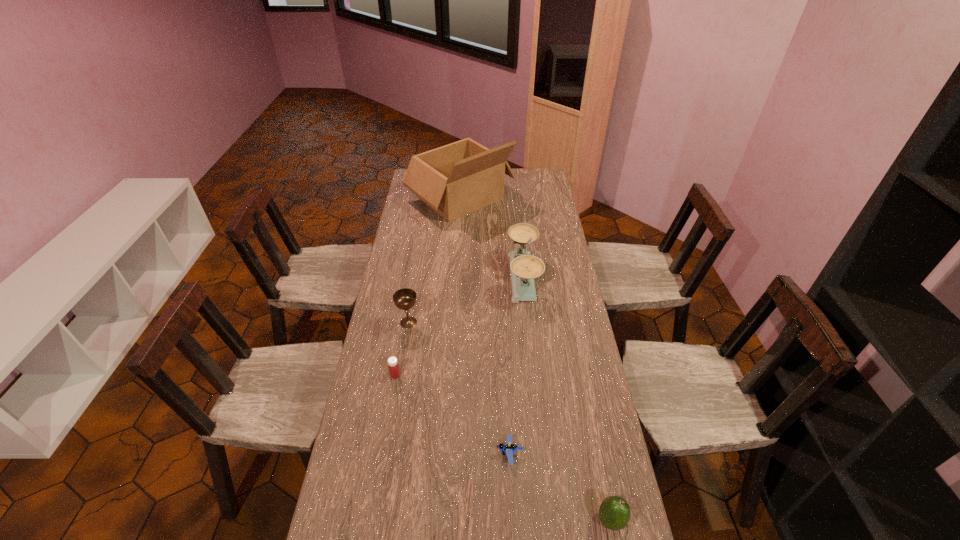
Where is `vacant region located 0.060m on the front-facing side of the shortest object`? vacant region located 0.060m on the front-facing side of the shortest object is located at coordinates tap(476, 454).

Locate an element on the screen. vacant space located 0.170m on the front-facing side of the shortest object is located at coordinates 439,454.

Find the location of a particular element. The image size is (960, 540). object located at the far edge is located at coordinates [x=454, y=180].

Where is `box that is at the left edge`? This screenshot has height=540, width=960. box that is at the left edge is located at coordinates (454, 180).

This screenshot has width=960, height=540. Find the location of `chalice present at the left edge`. chalice present at the left edge is located at coordinates (404, 299).

Where is `medicine that is at the left edge`? The width and height of the screenshot is (960, 540). medicine that is at the left edge is located at coordinates [393, 366].

Where is `scale present at the right edge`? The height and width of the screenshot is (540, 960). scale present at the right edge is located at coordinates (525, 267).

Locate an element on the screen. avocado that is at the right edge is located at coordinates (614, 512).

The image size is (960, 540). Find the location of `object that is positioned at the far left corner`. object that is positioned at the far left corner is located at coordinates (454, 180).

The image size is (960, 540). In order to click on free region at the left edge of the desktop in this screenshot , I will do `click(425, 214)`.